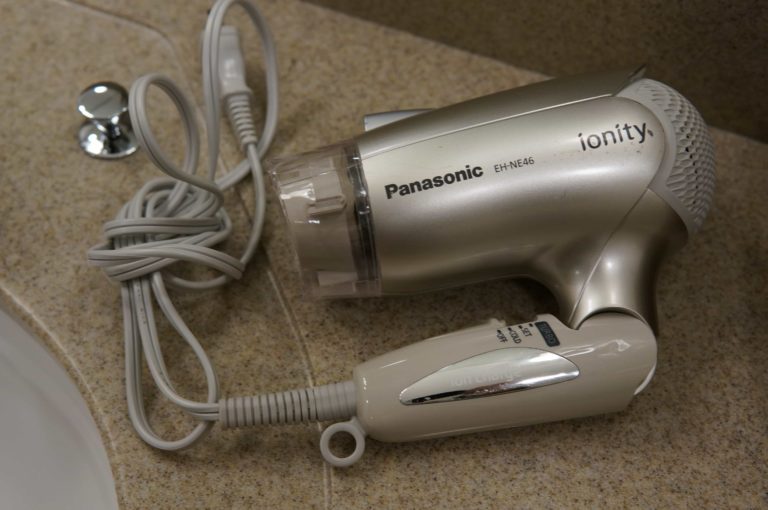
Where is `hanging hook`? The width and height of the screenshot is (768, 510). hanging hook is located at coordinates coord(359,439).